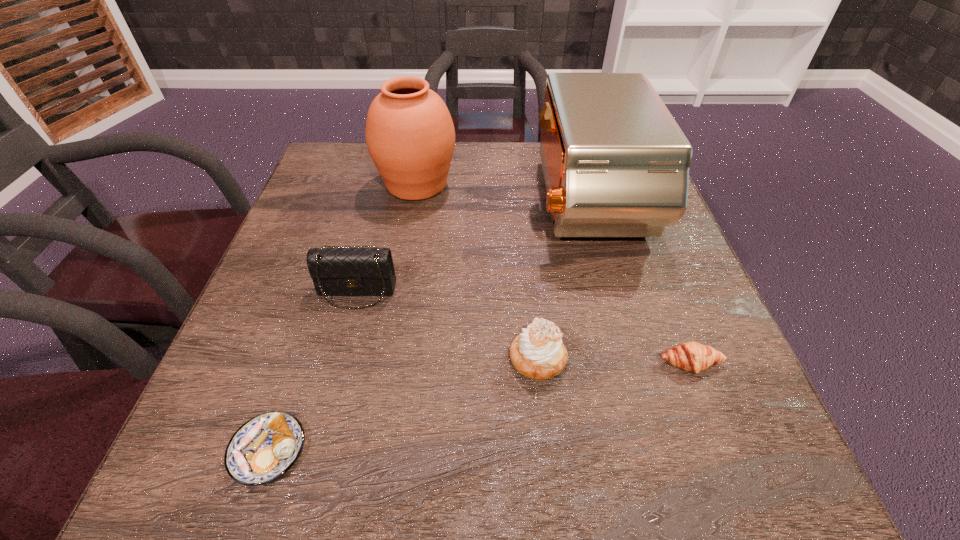
Find the location of a particular element. The height and width of the screenshot is (540, 960). blank area located on the door side of the toaster oven is located at coordinates (433, 205).

The height and width of the screenshot is (540, 960). Find the location of `free space located 0.090m on the front flap of the third farthest object`. free space located 0.090m on the front flap of the third farthest object is located at coordinates (342, 349).

You are a GUI agent. You are given a task and a screenshot of the screen. Output one action in this format:
    pyautogui.click(x=<x>, y=<y>)
    Task: Click on the blank space located on the right of the second pastry from left to right
    This screenshot has height=540, width=960.
    Given the screenshot: What is the action you would take?
    pyautogui.click(x=689, y=359)

The width and height of the screenshot is (960, 540). In order to click on vacant area situated on the front-facing side of the rightmost pastry in this screenshot , I will do `click(713, 423)`.

The height and width of the screenshot is (540, 960). Find the location of `free space located on the back of the nearest pastry`. free space located on the back of the nearest pastry is located at coordinates (293, 376).

Identify the location of urn positioned at the far edge. The image size is (960, 540). (410, 136).

Where is `toaster oven located at the far edge`? toaster oven located at the far edge is located at coordinates (616, 164).

Where is `object located at the near edge`? The height and width of the screenshot is (540, 960). object located at the near edge is located at coordinates (265, 447).

This screenshot has width=960, height=540. Identify the location of clutch bag that is at the left edge. (357, 271).

At what (x,y) coordinates should I click in order to perform the action: click on pastry located at the left edge. Please return your answer as a coordinate pair (x, y). The height and width of the screenshot is (540, 960). Looking at the image, I should click on (265, 447).